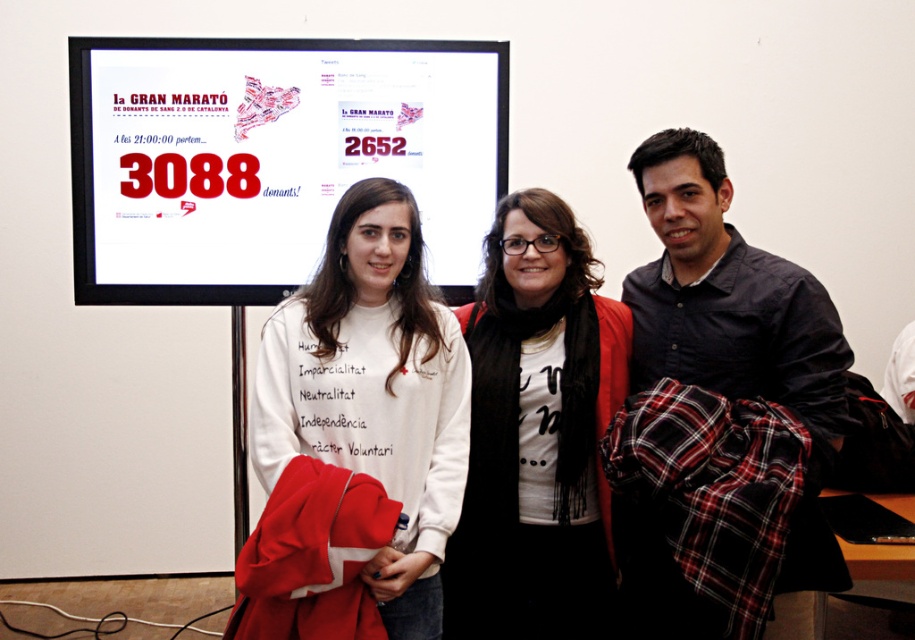
Is point (593, 442) behind point (428, 284)?

No, it is not.

Who is positioned more to the right, white matte t-shirt at center or white cotton sweatshirt at center?

white matte t-shirt at center is more to the right.

I want to click on white matte t-shirt at center, so click(536, 435).

The height and width of the screenshot is (640, 915). What do you see at coordinates (272, 157) in the screenshot?
I see `matte white poster at upper center` at bounding box center [272, 157].

Locate an element on the screen. Image resolution: width=915 pixels, height=640 pixels. matte white poster at upper center is located at coordinates (272, 157).

Who is higher up, white matte t-shirt at center or dark blue shirt at center?

dark blue shirt at center is above.

Where is `white matte t-shirt at center`? This screenshot has width=915, height=640. white matte t-shirt at center is located at coordinates (536, 435).

What are the coordinates of `white matte t-shirt at center` in the screenshot? It's located at (536, 435).